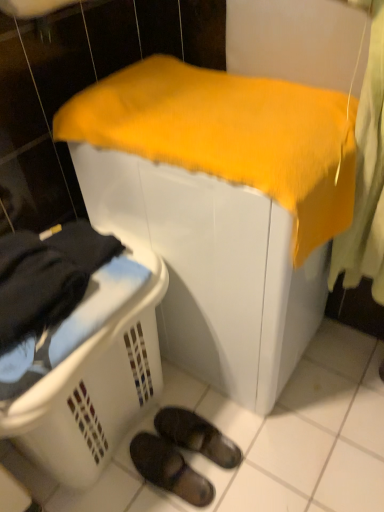
The width and height of the screenshot is (384, 512). Identify the location of vacant space behind black suede slippers at lower center, which is counted as the first footwear, starting from the top. (193, 398).